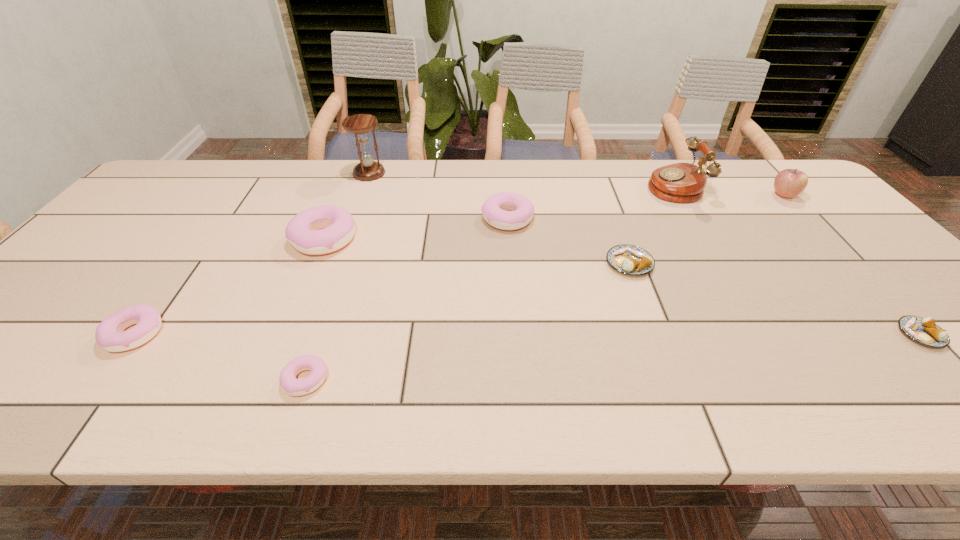
Where is `the sixth object from left to right`? The image size is (960, 540). the sixth object from left to right is located at coordinates (632, 260).

Identify the location of the farther brown pastry. (632, 260).

Find the location of a particular element. the nearest object is located at coordinates (295, 387).

The width and height of the screenshot is (960, 540). Find the location of `the nearest pink pastry`. the nearest pink pastry is located at coordinates click(295, 387).

The width and height of the screenshot is (960, 540). Identify the location of the nearer brown pastry. (922, 330).

I want to click on the rightmost pastry, so click(x=922, y=330).

Find the location of a particular element. vacant area located 0.230m on the left of the hourglass is located at coordinates (284, 173).

Locate an element on the screen. Image resolution: width=960 pixels, height=540 pixels. vacant region located 0.310m on the dial of the third object from right to left is located at coordinates pos(549,186).

This screenshot has width=960, height=540. Identify the location of free location located on the dial of the third object from right to left. (524, 186).

You are a GUI agent. You are given a task and a screenshot of the screen. Output one action in this format:
    pyautogui.click(x=<x>, y=<y>)
    Task: Click on the vacant point located 0.370m on the dial of the third object from right to left
    The height and width of the screenshot is (540, 960).
    Given the screenshot: What is the action you would take?
    pyautogui.click(x=530, y=186)